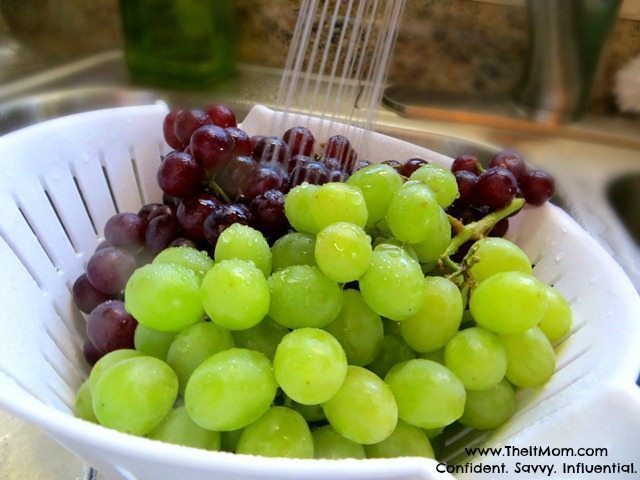
You are a GUI agent. You are given a task and a screenshot of the screen. Output one action in this format:
    pyautogui.click(x=<x>, y=<y>)
    Task: Click on the silver sink
    The image size is (640, 480).
    Given the screenshot: What is the action you would take?
    pyautogui.click(x=292, y=54), pyautogui.click(x=45, y=108), pyautogui.click(x=255, y=90), pyautogui.click(x=435, y=131), pyautogui.click(x=569, y=152), pyautogui.click(x=589, y=212)